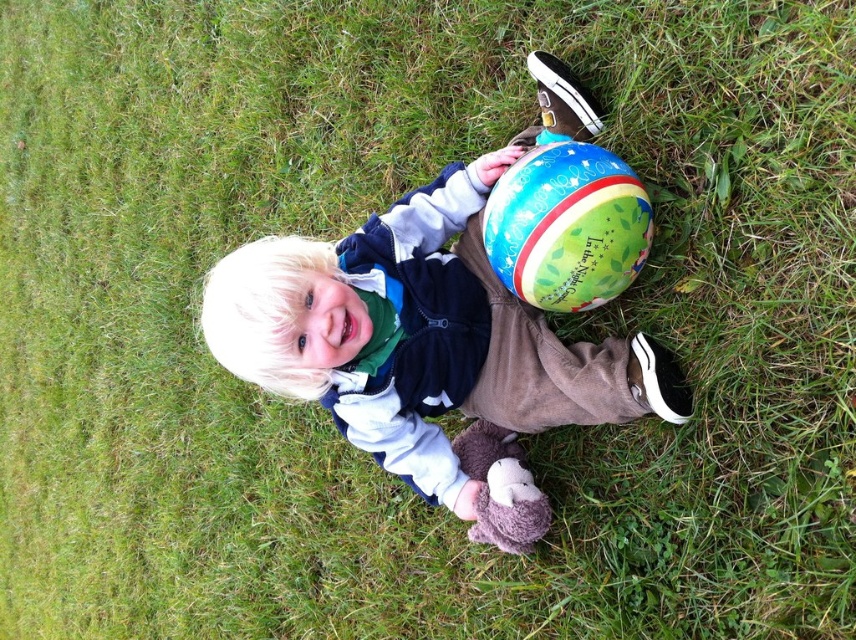
Is matte blue ball at center thinner than multicolored fabric beach ball at center?

No, matte blue ball at center is not thinner than multicolored fabric beach ball at center.

Is point (389, 378) closer to viewer compared to point (536, 200)?

No, it is behind (536, 200).

I want to click on matte blue ball at center, so (x=429, y=323).